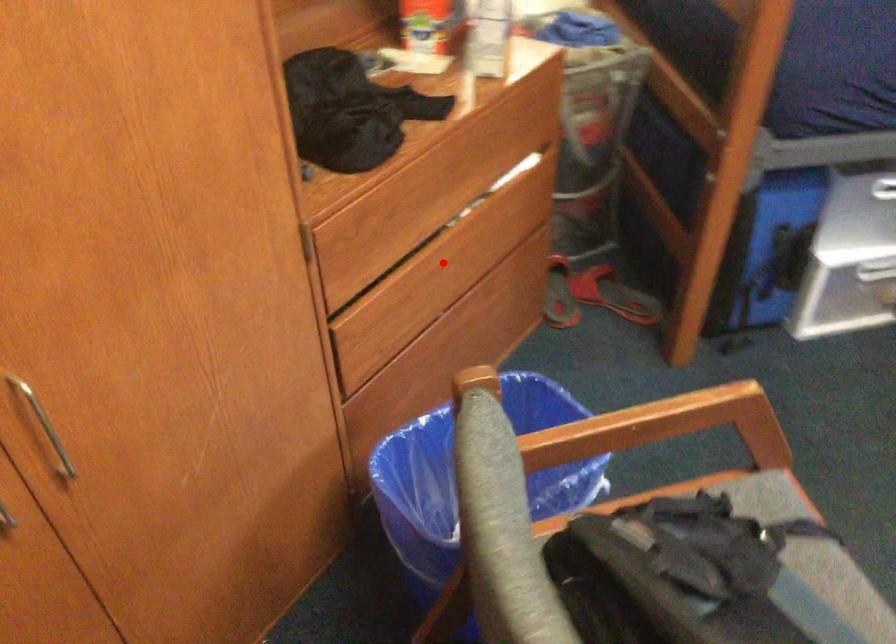
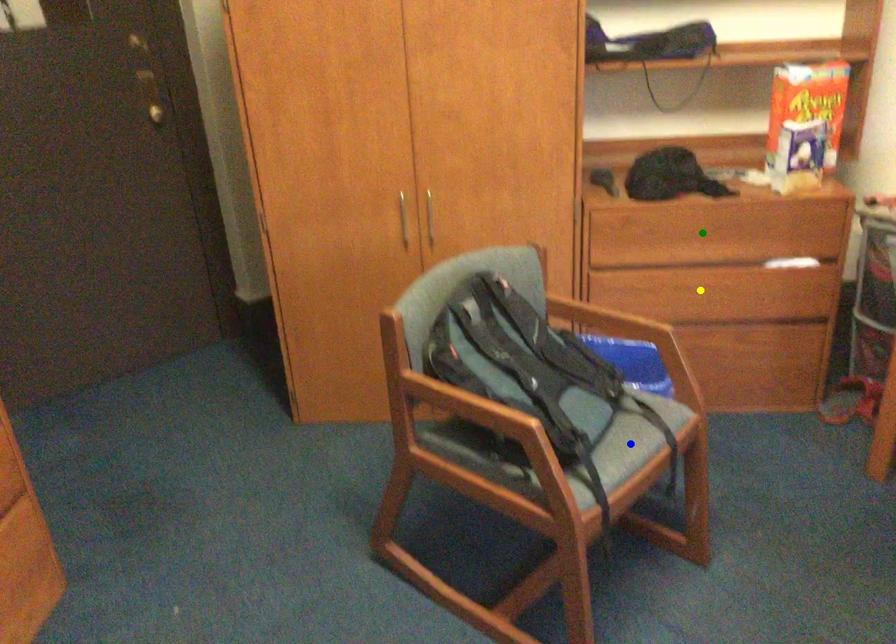
Question: I am providing you with two images of the same scene from different viewpoints. A red point is marked on the first image. You are given multiple points on the second image. Can you choose the point in image 2 that corresponds to the point in image 1?

Choices:
 (A) blue point
 (B) green point
 (C) yellow point

Answer: (C)